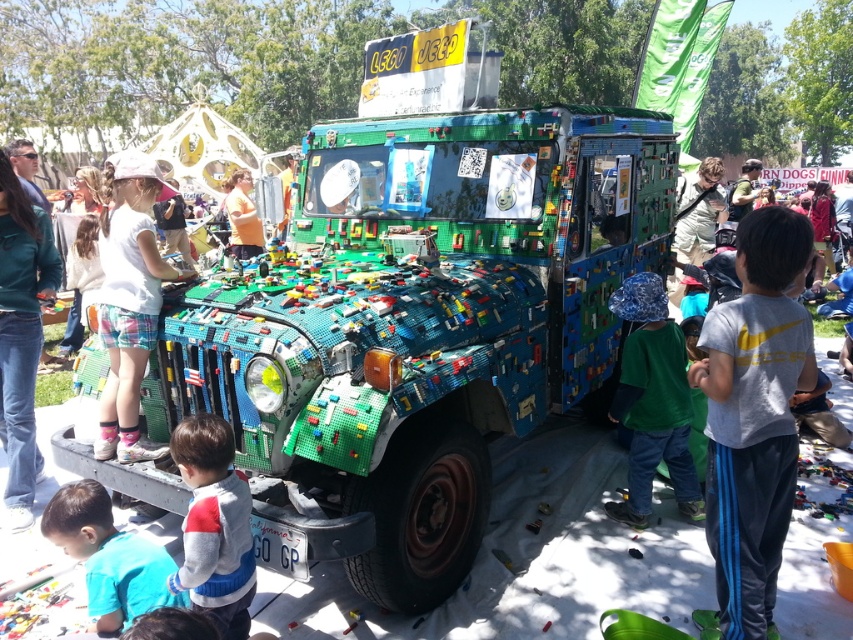
Question: In this image, where is multicolored plastic blocks at center located relative to orange shirt at center?

Choices:
 (A) right
 (B) left

Answer: (A)

Question: Which point is closer to the camera taking this photo?

Choices:
 (A) (680, 477)
 (B) (148, 456)
 (C) (196, 417)
 (D) (712, 387)

Answer: (D)

Question: Is white cotton shirt at center smaller than gray sweater at lower left?

Choices:
 (A) no
 (B) yes

Answer: (A)

Question: Which point is closer to the camera?

Choices:
 (A) (112, 532)
 (B) (746, 433)
 (C) (643, 452)

Answer: (B)

Question: Which point is farther to the camera?

Choices:
 (A) gray cotton shirt at center
 (B) gray sweater at lower left

Answer: (B)

Question: Is green fabric hat at center to the left of gray sweater at lower left from the viewer's perspective?

Choices:
 (A) no
 (B) yes

Answer: (A)